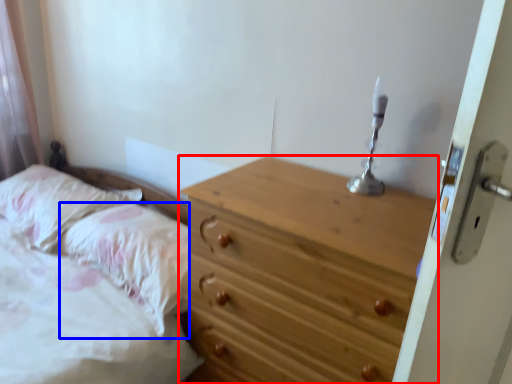
Question: Which object appears farthest to the camera in this image, chest of drawers (highlighted by a red box) or pillow (highlighted by a blue box)?

Choices:
 (A) chest of drawers
 (B) pillow

Answer: (B)